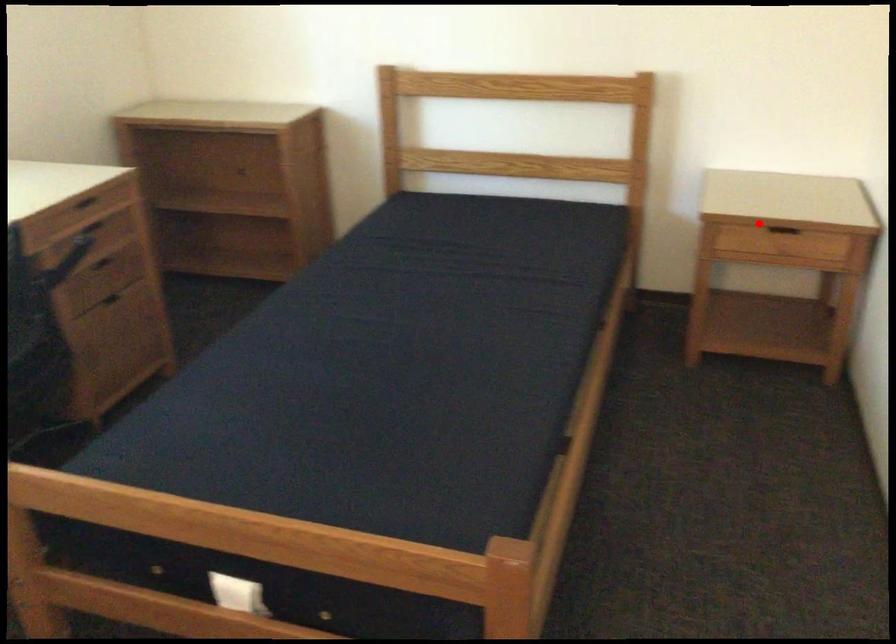
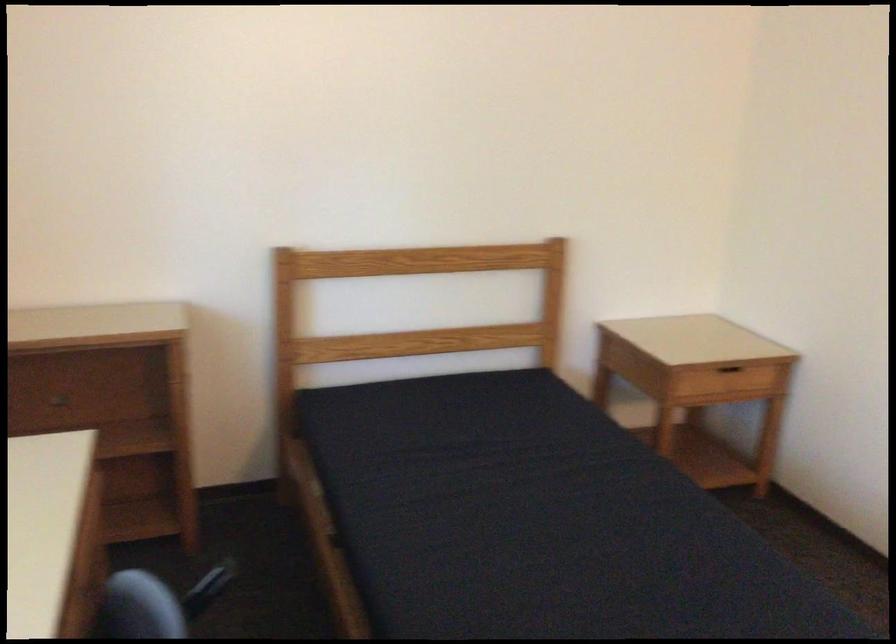
Question: I am providing you with two images of the same scene from different viewpoints. A red point is marked on the first image. At the location where the point appears in image 1, is it still visible in image 2?

Choices:
 (A) Yes
 (B) No

Answer: (A)